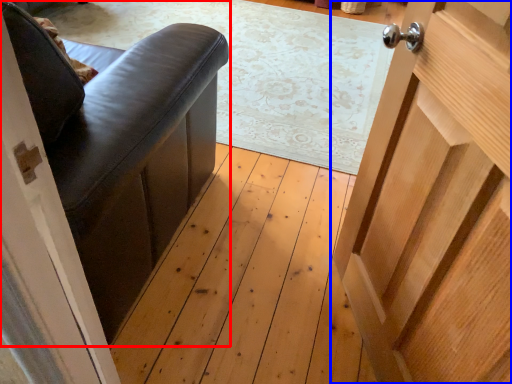
Question: Which point is closer to the camera, furniture (highlighted by a red box) or door (highlighted by a blue box)?

Choices:
 (A) furniture
 (B) door

Answer: (B)